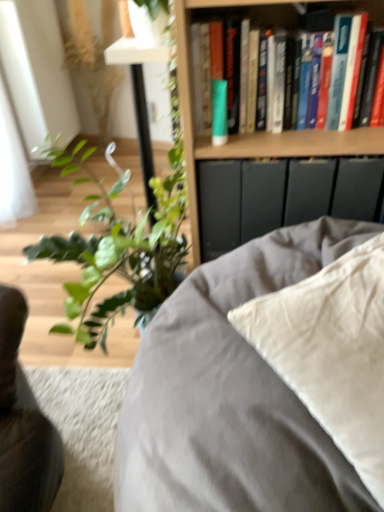
Image resolution: width=384 pixels, height=512 pixels. In order to click on hardcover books at upper right in this screenshot , I will do `click(250, 14)`.

The image size is (384, 512). Identify the location of satin beige pillow at center. (231, 395).

What is the approximate height of satin beige pillow at center?

satin beige pillow at center is 24.59 inches tall.

You are a GUI agent. You are given a task and a screenshot of the screen. Output one action in this format:
    pyautogui.click(x=<x>, y=<y>)
    Task: Click on the wooden bookshelf at upper center
    The height and width of the screenshot is (512, 384).
    Given the screenshot: What is the action you would take?
    pyautogui.click(x=254, y=132)

From a real-world perspective, between green matte tube at upper center and satin beige pillow at center, who is vertically higher?

In real-world perspective, green matte tube at upper center is above.

Is green matte tube at upper center situated inside satin beige pillow at center or outside?

The correct answer is: outside.

Considering the relative sizes of green matte tube at upper center and satin beige pillow at center in the image provided, is green matte tube at upper center taller than satin beige pillow at center?

No, green matte tube at upper center is not taller than satin beige pillow at center.

Is green matte tube at upper center in front of or behind satin beige pillow at center in the image?

Clearly, green matte tube at upper center is behind satin beige pillow at center.

Based on the photo, from a real-world perspective, who is located higher, green matte tube at upper center or wooden bookshelf at upper center?

From a 3D spatial view, green matte tube at upper center is above.

Can you confirm if green matte tube at upper center is positioned to the right of wooden bookshelf at upper center?

No.

At what (x,y) coordinates should I click in order to perform the action: click on bookcase below the green matte tube at upper center (from the image's perspective). Please return your answer as a coordinate pair (x, y). Looking at the image, I should click on (254, 132).

Is wooden bookshelf at upper center aimed at green matte tube at upper center?

Yes, wooden bookshelf at upper center is aimed at green matte tube at upper center.

This screenshot has height=512, width=384. I want to click on bookcase on the right of green matte tube at upper center, so pos(254,132).

Which object is closer to the camera, wooden bookshelf at upper center or green matte tube at upper center?

wooden bookshelf at upper center is closer to the camera.

Which is nearer, (315,463) or (278,10)?

Point (315,463)

From a real-world perspective, is satin beige pillow at center above or below hardcover books at upper right?

satin beige pillow at center is situated lower than hardcover books at upper right in the real world.

Between satin beige pillow at center and hardcover books at upper right, which one is positioned in front?

satin beige pillow at center is closer to the camera.

In terms of width, does satin beige pillow at center look wider or thinner when compared to hardcover books at upper right?

Considering their sizes, satin beige pillow at center looks broader than hardcover books at upper right.

Considering the relative positions of hardcover books at upper right and green matte tube at upper center in the image provided, is hardcover books at upper right to the right of green matte tube at upper center from the viewer's perspective?

Correct, you'll find hardcover books at upper right to the right of green matte tube at upper center.

Are hardcover books at upper right and green matte tube at upper center beside each other?

No.

What are the coordinates of `book above the green matte tube at upper center (from the image's perspective)` in the screenshot? It's located at (250, 14).

From a real-world perspective, which object stands above the other?

In real-world perspective, hardcover books at upper right is above.

Is satin beige pillow at center positioned beyond the bounds of green matte tube at upper center?

Yes.

Between satin beige pillow at center and green matte tube at upper center, which one has smaller width?

With smaller width is green matte tube at upper center.

Does satin beige pillow at center have a smaller size compared to green matte tube at upper center?

No.

Is wooden bookshelf at upper center to the right of satin beige pillow at center from the viewer's perspective?

Yes, wooden bookshelf at upper center is to the right of satin beige pillow at center.

Considering the sizes of wooden bookshelf at upper center and satin beige pillow at center in the image, is wooden bookshelf at upper center bigger or smaller than satin beige pillow at center?

Clearly, wooden bookshelf at upper center is smaller in size than satin beige pillow at center.

From a real-world perspective, is wooden bookshelf at upper center physically located above or below satin beige pillow at center?

In terms of real-world spatial position, wooden bookshelf at upper center is above satin beige pillow at center.

Based on the photo, could you tell me if wooden bookshelf at upper center is facing satin beige pillow at center?

No, wooden bookshelf at upper center is not turned towards satin beige pillow at center.

This screenshot has height=512, width=384. I want to click on paperback book behind the satin beige pillow at center, so point(219,112).

The width and height of the screenshot is (384, 512). I want to click on bookcase below the green matte tube at upper center (from a real-world perspective), so click(x=254, y=132).

Considering their positions, is wooden bookshelf at upper center positioned further to satin beige pillow at center than hardcover books at upper right?

Among the two, hardcover books at upper right is located further to satin beige pillow at center.

Estimate the real-world distances between objects in this image. Which object is further from green matte tube at upper center, hardcover books at upper right or wooden bookshelf at upper center?

hardcover books at upper right is further to green matte tube at upper center.

From the image, which object appears to be nearer to hardcover books at upper right, green matte tube at upper center or wooden bookshelf at upper center?

Based on the image, wooden bookshelf at upper center appears to be nearer to hardcover books at upper right.

From the image, which object appears to be nearer to green matte tube at upper center, satin beige pillow at center or hardcover books at upper right?

hardcover books at upper right is positioned closer to the anchor green matte tube at upper center.

From the image, which object appears to be nearer to satin beige pillow at center, hardcover books at upper right or green matte tube at upper center?

The object closer to satin beige pillow at center is green matte tube at upper center.

Which object lies nearer to the anchor point green matte tube at upper center, wooden bookshelf at upper center or satin beige pillow at center?

wooden bookshelf at upper center lies closer to green matte tube at upper center than the other object.

From the picture: Considering their positions, is green matte tube at upper center positioned further to hardcover books at upper right than satin beige pillow at center?

Based on the image, satin beige pillow at center appears to be further to hardcover books at upper right.

Looking at the image, which one is located closer to green matte tube at upper center, wooden bookshelf at upper center or hardcover books at upper right?

Based on the image, wooden bookshelf at upper center appears to be nearer to green matte tube at upper center.

You are a GUI agent. You are given a task and a screenshot of the screen. Output one action in this format:
    pyautogui.click(x=<x>, y=<y>)
    Task: Click on the book between green matte tube at upper center and wooden bookshelf at upper center from left to right
    
    Given the screenshot: What is the action you would take?
    pyautogui.click(x=250, y=14)

Find the location of `bookcase between green matte tube at upper center and satin beige pillow at center vertically`. bookcase between green matte tube at upper center and satin beige pillow at center vertically is located at coordinates (254, 132).

Where is `bookcase between hardcover books at upper right and satin beige pillow at center in the vertical direction`? bookcase between hardcover books at upper right and satin beige pillow at center in the vertical direction is located at coordinates (254, 132).

Where is `paperback book between hardcover books at upper right and satin beige pillow at center vertically`? paperback book between hardcover books at upper right and satin beige pillow at center vertically is located at coordinates (x=219, y=112).